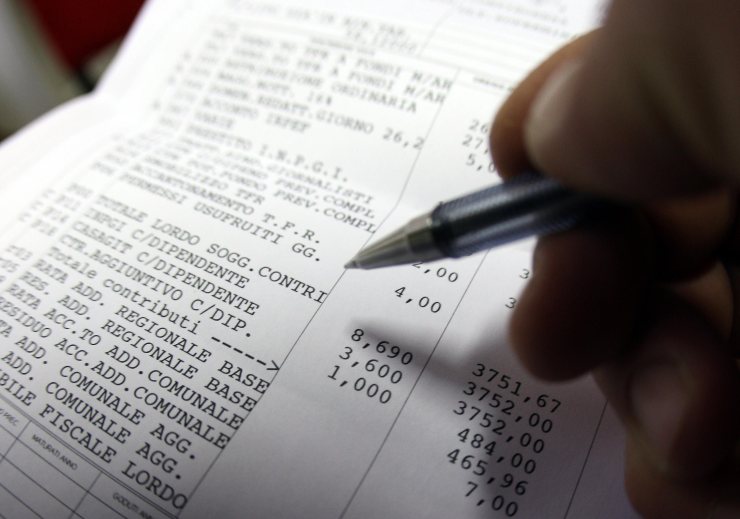
At what (x,y) coordinates should I click in order to perform the action: click on wall. Please return your answer as a coordinate pair (x, y). Looking at the image, I should click on (53, 69).